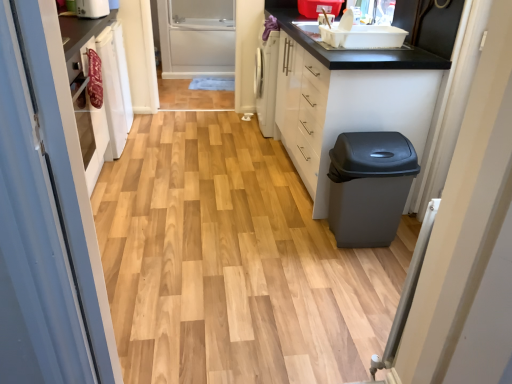
Locate an element on the screen. free region on the left part of matte gray trash can at right is located at coordinates (301, 238).